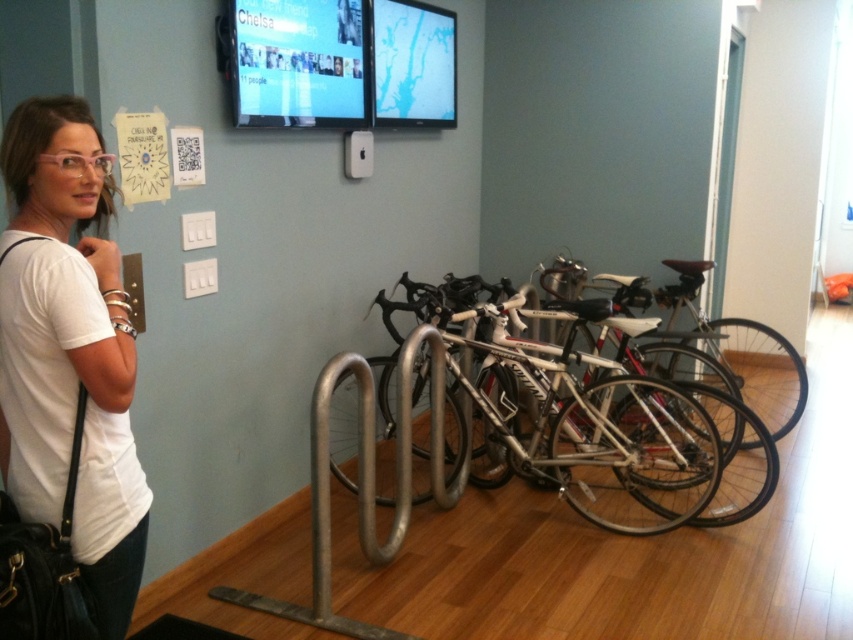
What is the location of the point labeled as (624, 408) in the image?

The point labeled as (624, 408) is located on the silver metallic bicycle at center.